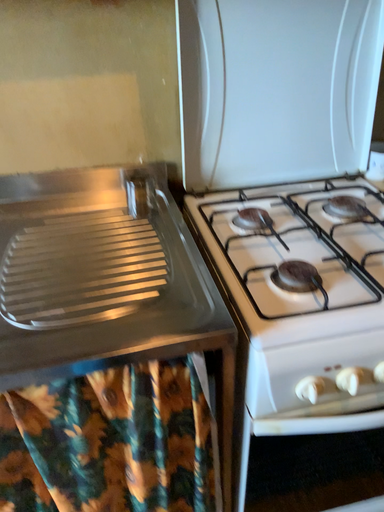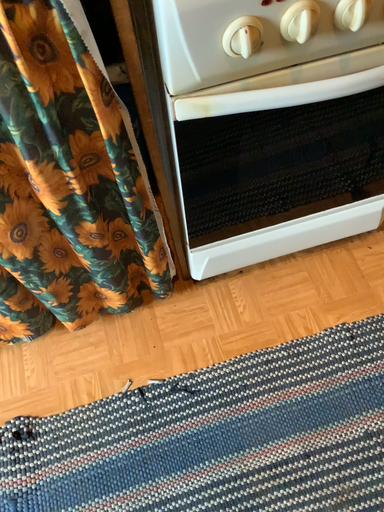
Question: How did the camera likely rotate when shooting the video?

Choices:
 (A) rotated upward
 (B) rotated downward

Answer: (B)